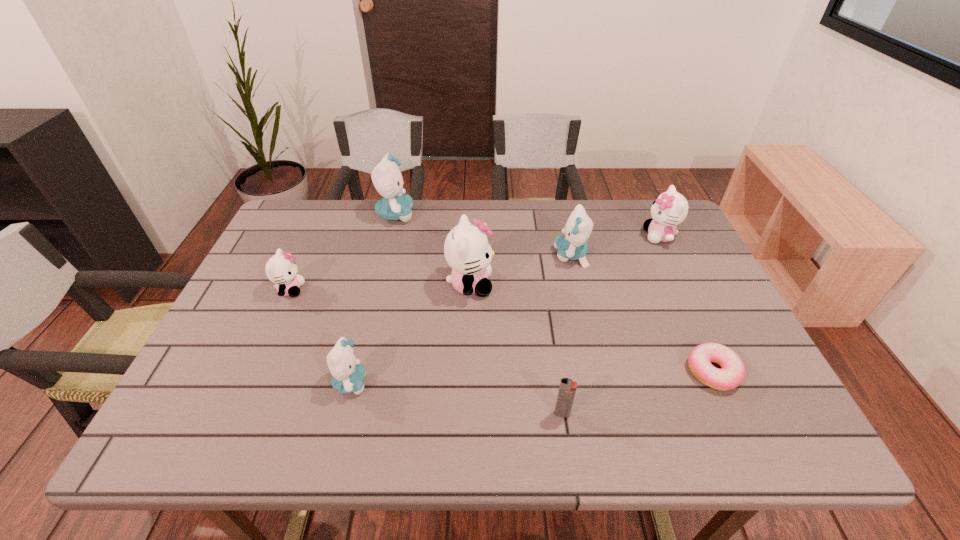
Where is `object that is the fifth closest to the rightmost white kitten`? The image size is (960, 540). object that is the fifth closest to the rightmost white kitten is located at coordinates (396, 205).

Locate an element on the screen. The image size is (960, 540). kitten that stands as the closest to the second biggest blue kitten is located at coordinates (467, 250).

Identify which kitten is the fourth closest to the fourth object from left to right. Please provide its 2D coordinates. Your answer should be formatted as a tuple, i.e. [(x, y)], where the tuple contains the x and y coordinates of a point satisfying the conditions above.

[(281, 269)]

Where is `blue kitten that is the nearest to the rightmost white kitten`? blue kitten that is the nearest to the rightmost white kitten is located at coordinates (572, 246).

Choose which blue kitten is the third nearest neighbor to the fifth object from right to left. Please provide its 2D coordinates. Your answer should be formatted as a tuple, i.e. [(x, y)], where the tuple contains the x and y coordinates of a point satisfying the conditions above.

[(347, 373)]

At what (x,y) coordinates should I click in order to perform the action: click on white kitten object that ranks as the second closest to the leftmost kitten. Please return your answer as a coordinate pair (x, y). This screenshot has width=960, height=540. Looking at the image, I should click on (670, 209).

The width and height of the screenshot is (960, 540). Find the location of `white kitten identified as the third closest to the farthest blue kitten`. white kitten identified as the third closest to the farthest blue kitten is located at coordinates (670, 209).

This screenshot has width=960, height=540. Find the location of `blank space that satisfies the following two spatial constraints: 1. on the front-facing side of the leftmost white kitten; 2. on the back side of the igniter`. blank space that satisfies the following two spatial constraints: 1. on the front-facing side of the leftmost white kitten; 2. on the back side of the igniter is located at coordinates (234, 414).

Find the location of a particular element. free location that satisfies the following two spatial constraints: 1. on the front-facing side of the biggest white kitten; 2. on the left side of the nearest object is located at coordinates (467, 414).

Find the location of a particular element. This screenshot has height=540, width=960. free point that satisfies the following two spatial constraints: 1. on the front-facing side of the smallest white kitten; 2. on the back side of the pink doughnut is located at coordinates (253, 372).